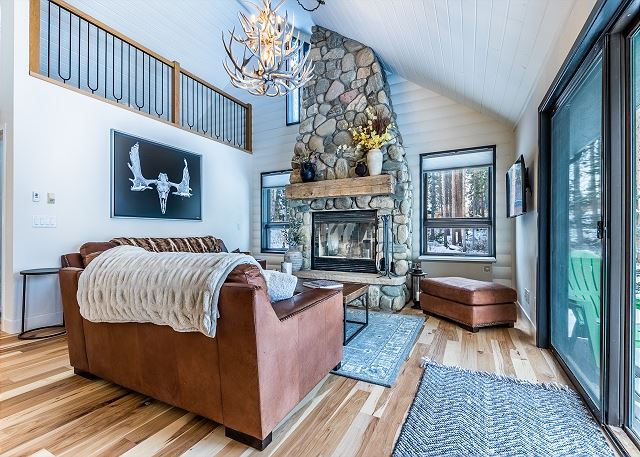
Image resolution: width=640 pixels, height=457 pixels. I want to click on left wall white, so click(x=51, y=107), click(x=51, y=163), click(x=60, y=239), click(x=92, y=117), click(x=97, y=233), click(x=159, y=227), click(x=226, y=219), click(x=218, y=160), click(x=155, y=131).